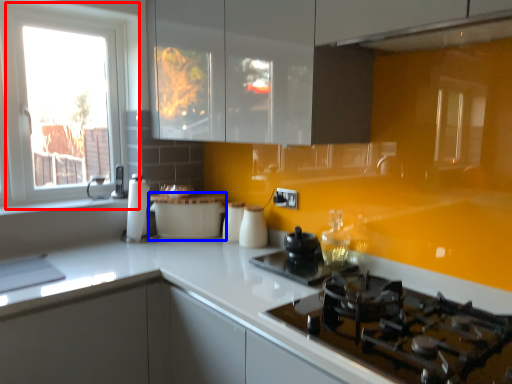
Question: Among these objects, which one is nearest to the camera, window (highlighted by a red box) or kitchen appliance (highlighted by a blue box)?

Choices:
 (A) window
 (B) kitchen appliance

Answer: (A)